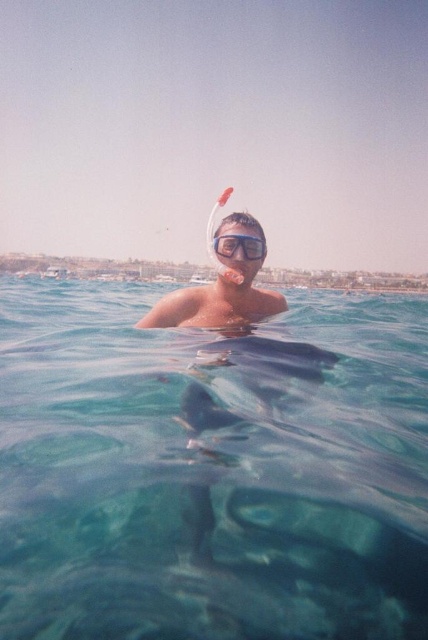
Is clear blue water at center wider than matte plastic snorkel at upper center?

Indeed, clear blue water at center has a greater width compared to matte plastic snorkel at upper center.

This screenshot has width=428, height=640. Find the location of `clear blue water at center`. clear blue water at center is located at coordinates (211, 470).

Identify the location of clear blue water at center. (211, 470).

Can you confirm if matte plastic snorkel at upper center is shorter than transparent plastic goggles at center?

No, matte plastic snorkel at upper center is not shorter than transparent plastic goggles at center.

This screenshot has height=640, width=428. What do you see at coordinates (222, 284) in the screenshot? I see `matte plastic snorkel at upper center` at bounding box center [222, 284].

Does point (270, 296) come farther from viewer compared to point (250, 234)?

That is True.

I want to click on matte plastic snorkel at upper center, so click(x=222, y=284).

Is clear blue water at center closer to camera compared to transparent plastic goggles at center?

Yes, clear blue water at center is closer to the viewer.

Can you confirm if clear blue water at center is positioned to the right of transparent plastic goggles at center?

Correct, you'll find clear blue water at center to the right of transparent plastic goggles at center.

What do you see at coordinates (211, 470) in the screenshot? This screenshot has height=640, width=428. I see `clear blue water at center` at bounding box center [211, 470].

Image resolution: width=428 pixels, height=640 pixels. What are the coordinates of `clear blue water at center` in the screenshot? It's located at (211, 470).